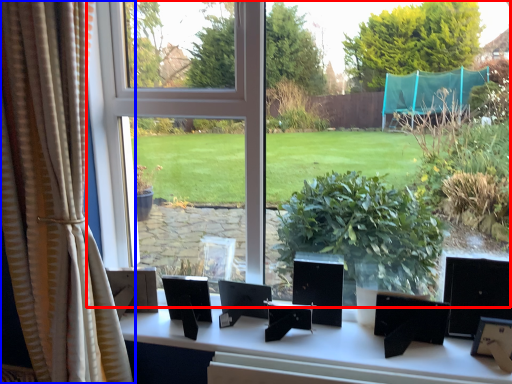
Question: Which object is closer to the camera taking this photo, window (highlighted by a red box) or curtain (highlighted by a blue box)?

Choices:
 (A) window
 (B) curtain

Answer: (B)